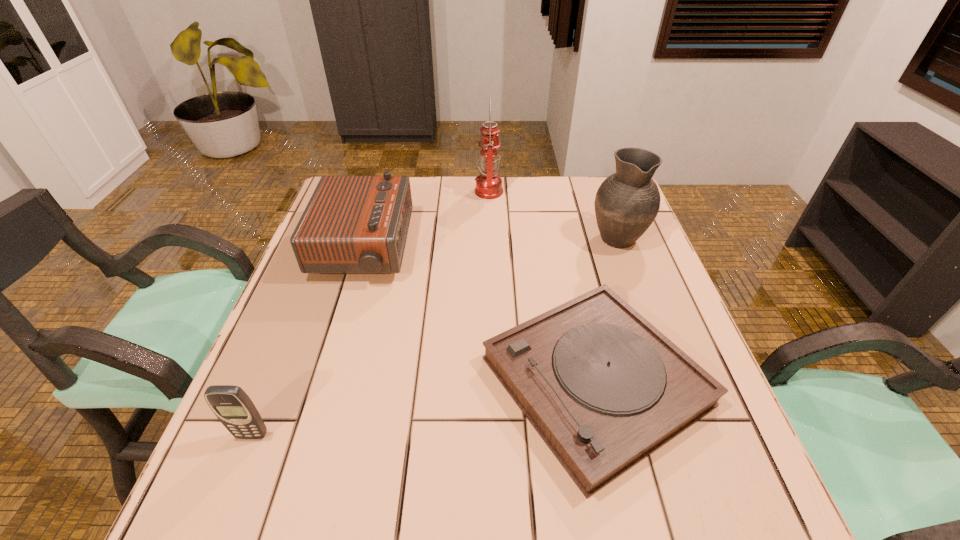
Identify the location of phonograph record that is at the right edge. (604, 388).

Image resolution: width=960 pixels, height=540 pixels. I want to click on object that is at the far left corner, so click(352, 224).

Find the location of a particular element. object located in the far right corner section of the desktop is located at coordinates pyautogui.click(x=627, y=202).

What are the coordinates of `object that is at the near right corner` in the screenshot? It's located at (604, 388).

I want to click on vacant space at the far edge of the desktop, so click(444, 177).

Where is `free region at the near edge`? free region at the near edge is located at coordinates tap(487, 484).

Find the location of a particular element. free space at the left edge of the desktop is located at coordinates (231, 437).

Locate an element on the screen. vacant area at the far right corner of the desktop is located at coordinates (593, 176).

You are a GUI agent. You are given a task and a screenshot of the screen. Output one action in this format:
    pyautogui.click(x=<x>, y=<y>)
    Task: Click on the vacant area at the near right corner of the desktop
    
    Given the screenshot: What is the action you would take?
    pyautogui.click(x=687, y=522)

Find the location of a particular element. This screenshot has width=960, height=540. vacant region between the fourth shortest object and the oil lamp is located at coordinates pos(553,214).